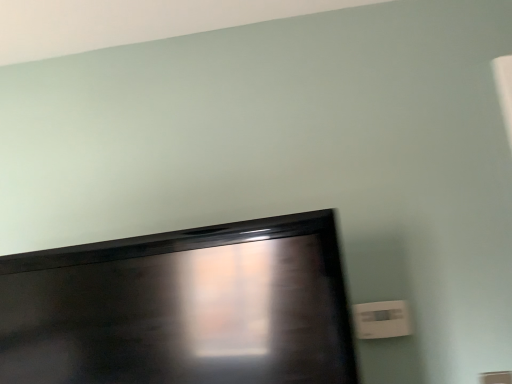
Question: From the image's perspective, does matte black tv at lower left appear lower than white plastic electric outlet at lower right?

Choices:
 (A) no
 (B) yes

Answer: (A)

Question: Is matte black tv at lower left facing away from white plastic electric outlet at lower right?

Choices:
 (A) yes
 (B) no

Answer: (A)

Question: From a real-world perspective, is matte black tv at lower left located beneath white plastic electric outlet at lower right?

Choices:
 (A) yes
 (B) no

Answer: (B)

Question: Is matte black tv at lower left bigger than white plastic electric outlet at lower right?

Choices:
 (A) no
 (B) yes

Answer: (B)

Question: Can you confirm if matte black tv at lower left is wider than white plastic electric outlet at lower right?

Choices:
 (A) yes
 (B) no

Answer: (A)

Question: Does matte black tv at lower left touch white plastic electric outlet at lower right?

Choices:
 (A) yes
 (B) no

Answer: (B)

Question: Is white plastic electric outlet at lower right touching matte black tv at lower left?

Choices:
 (A) no
 (B) yes

Answer: (A)

Question: Is white plastic electric outlet at lower right looking in the opposite direction of matte black tv at lower left?

Choices:
 (A) yes
 (B) no

Answer: (B)

Question: Is matte black tv at lower left a part of white plastic electric outlet at lower right?

Choices:
 (A) no
 (B) yes

Answer: (A)

Question: From the image's perspective, is white plastic electric outlet at lower right located beneath matte black tv at lower left?

Choices:
 (A) no
 (B) yes

Answer: (B)

Question: Can you confirm if white plastic electric outlet at lower right is positioned to the left of matte black tv at lower left?

Choices:
 (A) yes
 (B) no

Answer: (B)

Question: Considering the relative sizes of white plastic electric outlet at lower right and matte black tv at lower left in the image provided, is white plastic electric outlet at lower right shorter than matte black tv at lower left?

Choices:
 (A) yes
 (B) no

Answer: (A)

Question: From a real-world perspective, is matte black tv at lower left above or below white plastic electric outlet at lower right?

Choices:
 (A) below
 (B) above

Answer: (B)